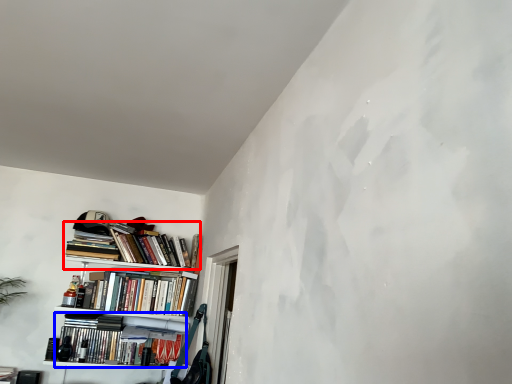
Question: Which of the following is the closest to the observer, book (highlighted by a red box) or book (highlighted by a blue box)?

Choices:
 (A) book
 (B) book

Answer: (B)